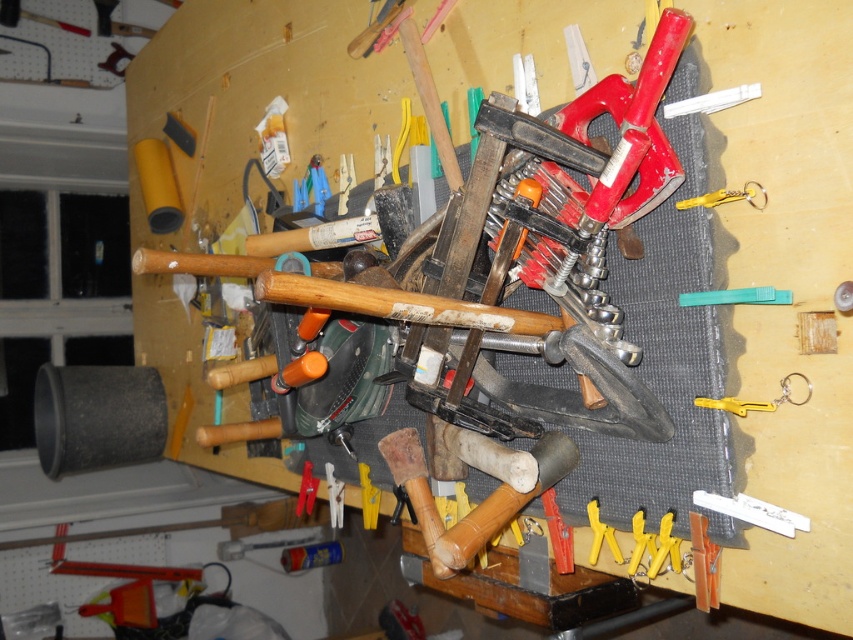
Who is more distant from viewer, (752, 180) or (631, 556)?

Positioned behind is point (631, 556).

Measure the distance between point (706, 198) and camera.

Point (706, 198) is 33.51 inches from camera.

Who is more distant from viewer, [717,202] or [634,556]?

The point [634,556] is more distant.

Image resolution: width=853 pixels, height=640 pixels. What are the coordinates of `yellow plastic keychain at upper right` in the screenshot? It's located at (727, 196).

Identify the location of yellow plastic clamps at lower center. (601, 534).

Between yellow plastic clamps at lower center and yellow plastic clamp at center, which one has less height?

Standing shorter between the two is yellow plastic clamps at lower center.

Where is `yellow plastic clamps at lower center`? The height and width of the screenshot is (640, 853). yellow plastic clamps at lower center is located at coordinates (601, 534).

In order to click on yellow plastic clamps at lower center in this screenshot , I will do `click(601, 534)`.

Between yellow plastic clamps at lower center and metallic red clamp at center, which one appears on the right side from the viewer's perspective?

From the viewer's perspective, yellow plastic clamps at lower center appears more on the right side.

Which of these two, yellow plastic clamps at lower center or metallic red clamp at center, stands taller?

With more height is metallic red clamp at center.

Between point (608, 531) and point (309, 470), which one is positioned in front?

Point (608, 531)

Where is `yellow plastic clamps at lower center`? yellow plastic clamps at lower center is located at coordinates (601, 534).